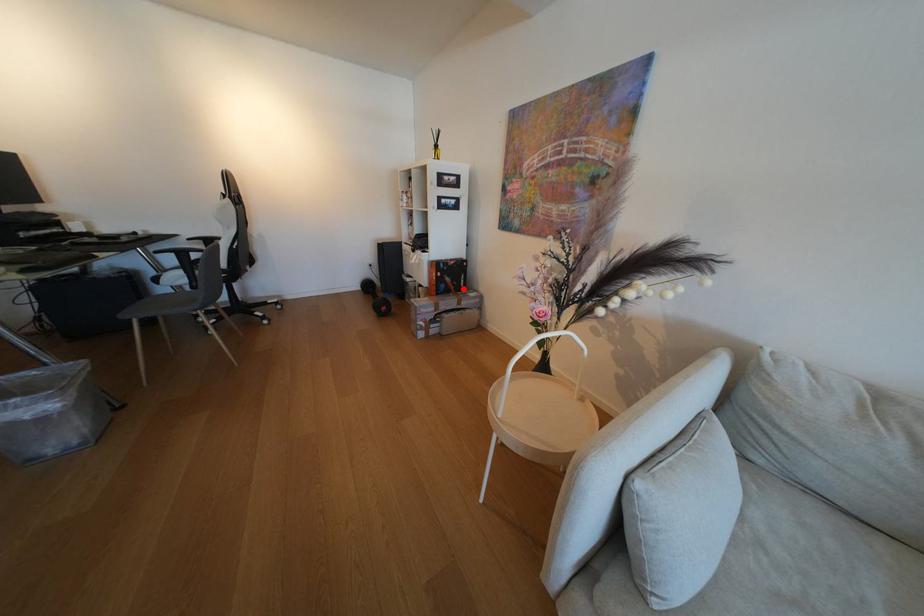
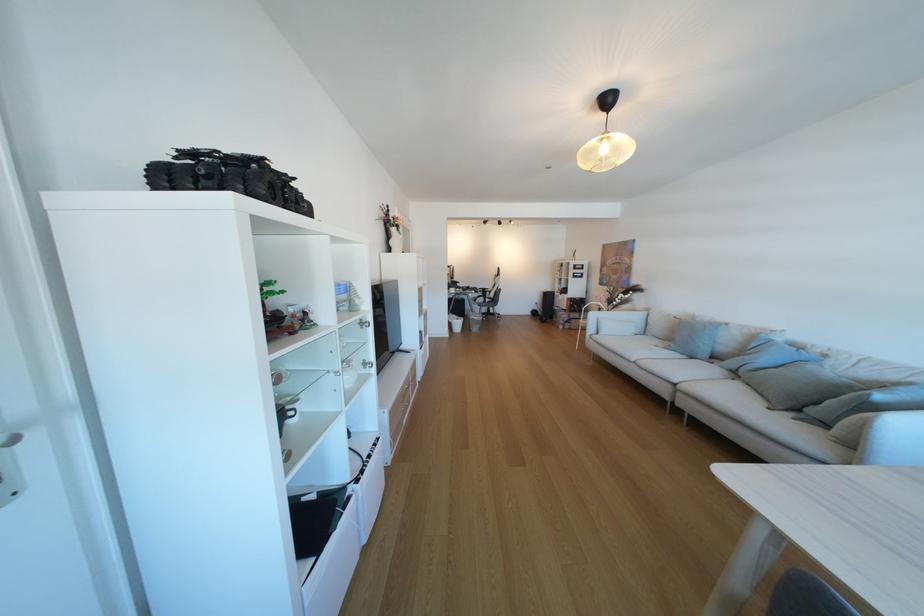
Question: I am providing you with two images of the same scene from different viewpoints. A red point is marked on the first image. Can you still see the location of the red point in image 2?

Choices:
 (A) Yes
 (B) No

Answer: (A)